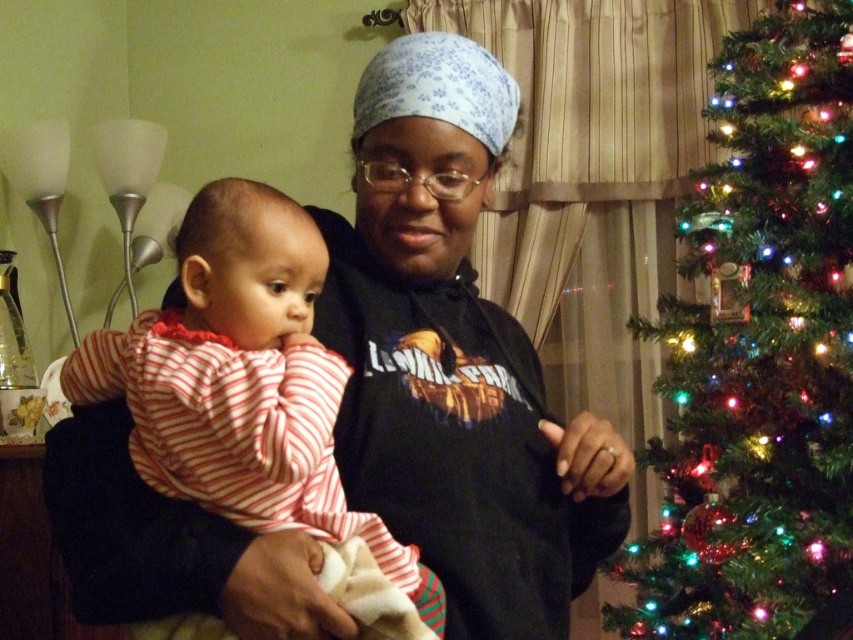
Question: Which point is closer to the camera?

Choices:
 (A) (595, 442)
 (B) (825, 150)

Answer: (A)

Question: Is black matte hoodie at center to the right of iridescent plastic tree at right from the viewer's perspective?

Choices:
 (A) yes
 (B) no

Answer: (B)

Question: Which of the following is the closest to the observer?

Choices:
 (A) (512, 401)
 (B) (659, 474)

Answer: (A)

Question: Does black matte hoodie at center appear over iridescent plastic tree at right?

Choices:
 (A) yes
 (B) no

Answer: (B)

Question: Is black matte hoodie at center thinner than iridescent plastic tree at right?

Choices:
 (A) yes
 (B) no

Answer: (B)

Question: Which point is farther to the camera?

Choices:
 (A) iridescent plastic tree at right
 (B) black matte hoodie at center

Answer: (A)